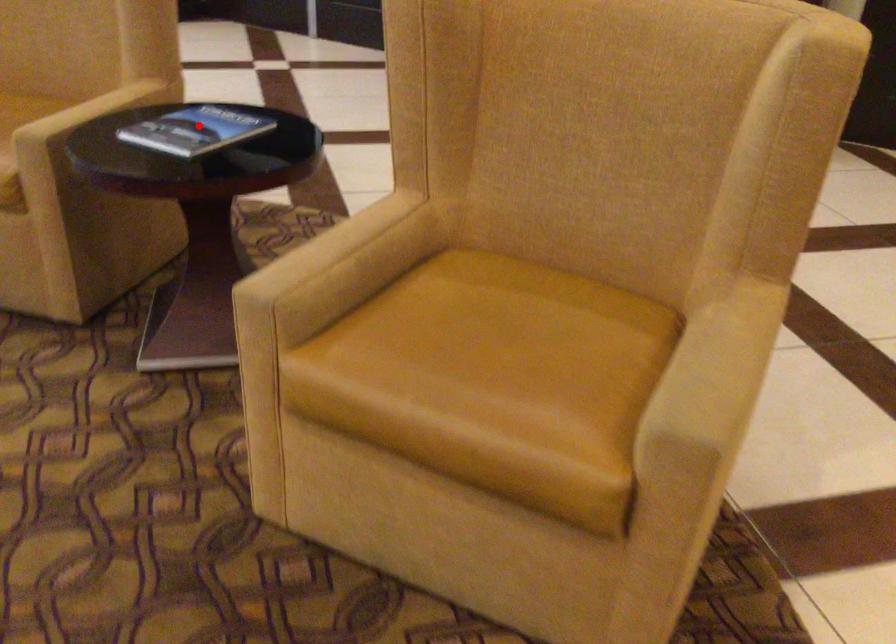
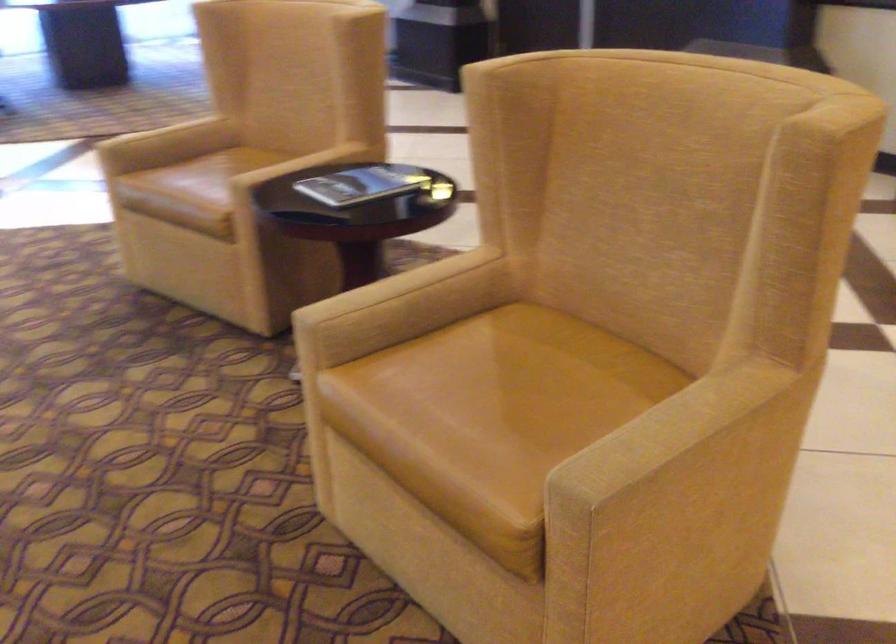
Question: I am providing you with two images of the same scene from different viewpoints. Image1 has a red point marked. In image2, the corresponding 3D location appears at what relative position? Reply with the corresponding letter.

Choices:
 (A) Closer
 (B) Farther

Answer: (B)